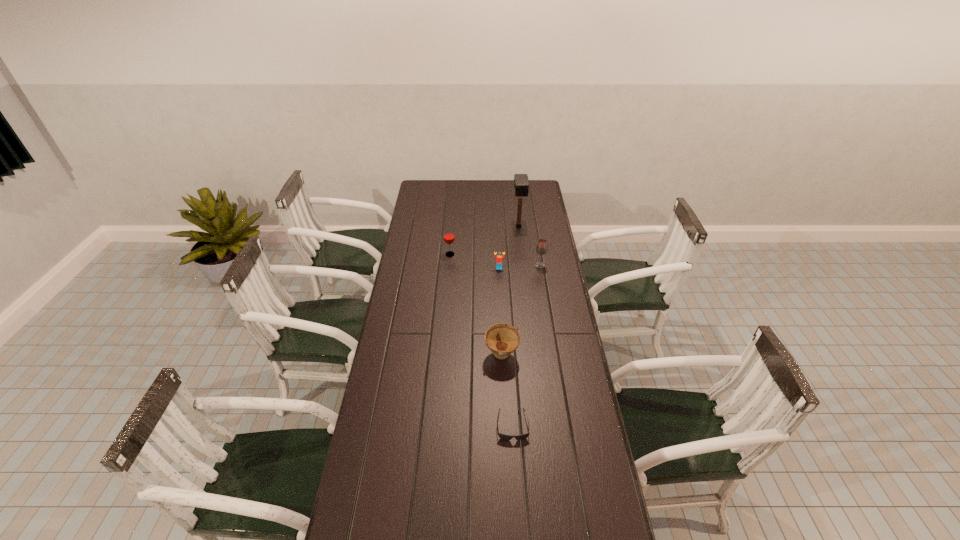
At what (x,y) coordinates should I click in order to perform the action: click on the fifth object from left to right. Please return your answer as a coordinate pair (x, y). Looking at the image, I should click on (521, 183).

Identify the location of the tallest object. The width and height of the screenshot is (960, 540). (521, 183).

The image size is (960, 540). Identify the location of the right glass. (541, 248).

Where is `the nearer glass`? This screenshot has height=540, width=960. the nearer glass is located at coordinates (541, 248).

I want to click on the left glass, so click(449, 237).

Where is `the farther glass`? This screenshot has width=960, height=540. the farther glass is located at coordinates (449, 237).

What are the coordinates of `the fourth tallest object` in the screenshot? It's located at (502, 339).

Where is `soup bowl`? This screenshot has width=960, height=540. soup bowl is located at coordinates (502, 339).

At what (x,y) coordinates should I click in order to perform the action: click on the second shortest object. Please return your answer as a coordinate pair (x, y). Looking at the image, I should click on (499, 257).

The width and height of the screenshot is (960, 540). Find the location of `the shortest object`. the shortest object is located at coordinates (506, 437).